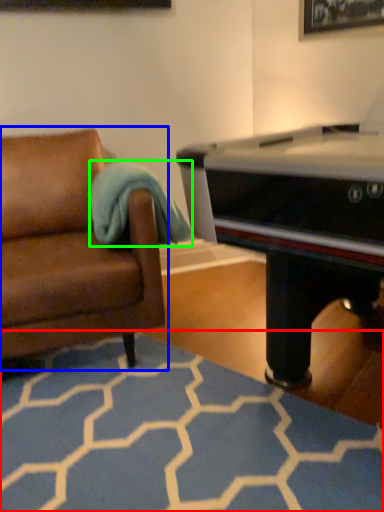
Question: Which object is the closest to the plain (highlighted by a red box)? Choose among these: studio couch (highlighted by a blue box) or blanket (highlighted by a green box).

Choices:
 (A) studio couch
 (B) blanket

Answer: (A)